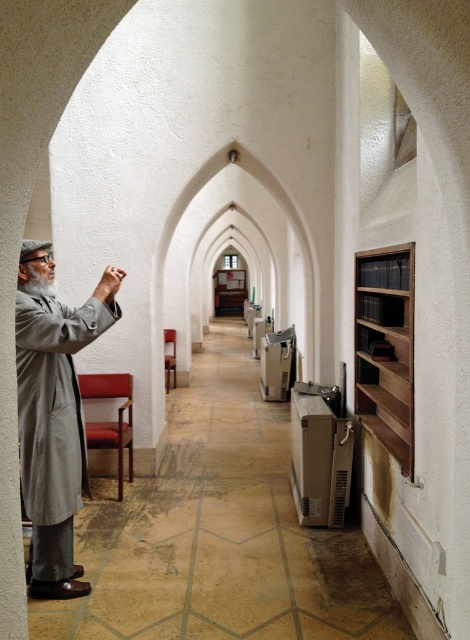
Which is below, light gray woolen robe at left or dark brown wooden bookshelf at right?

light gray woolen robe at left

Can you confirm if light gray woolen robe at left is wider than dark brown wooden bookshelf at right?

Correct, the width of light gray woolen robe at left exceeds that of dark brown wooden bookshelf at right.

The width and height of the screenshot is (470, 640). In order to click on light gray woolen robe at left in this screenshot , I will do `click(53, 419)`.